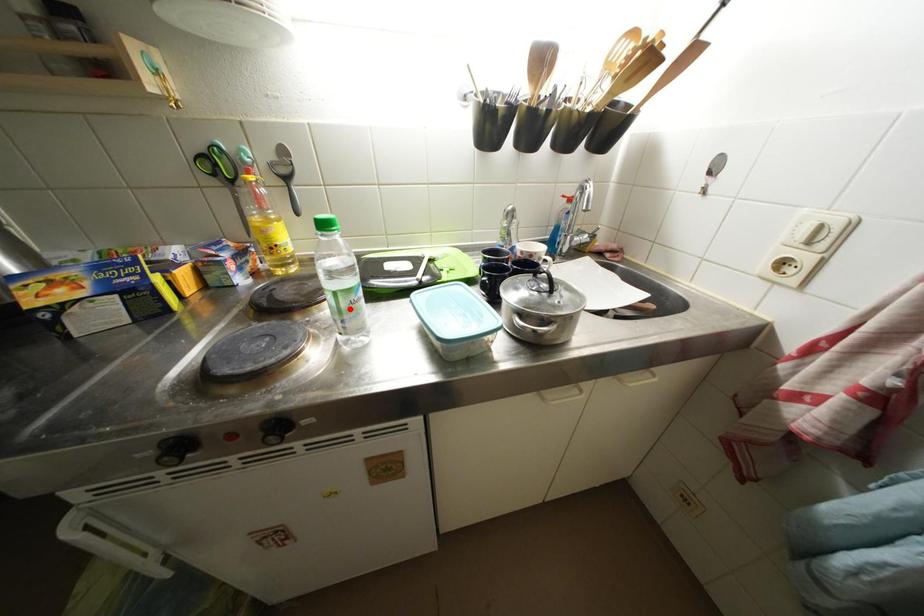
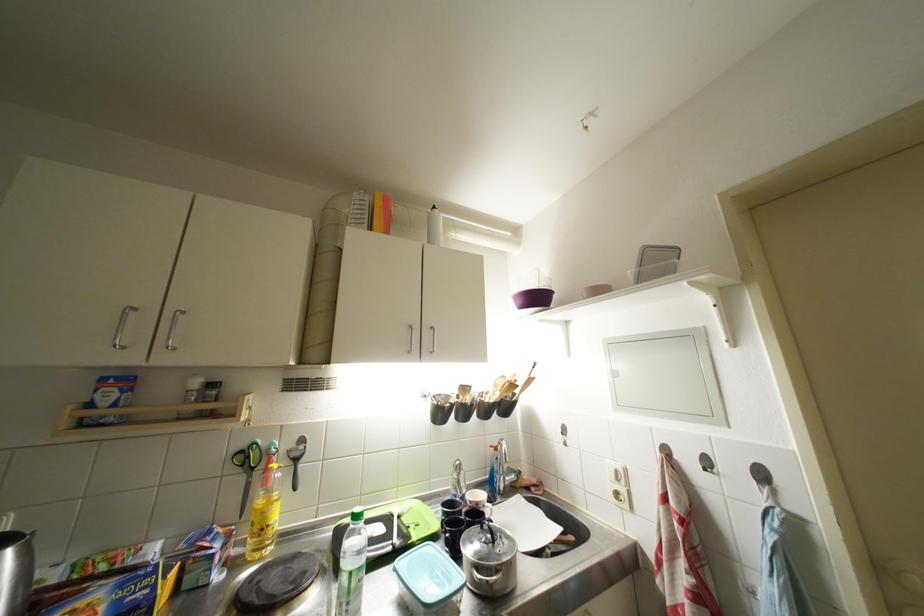
The point at the highlighted location is marked in the first image. Where is the corresponding point in the second image?

(359, 589)